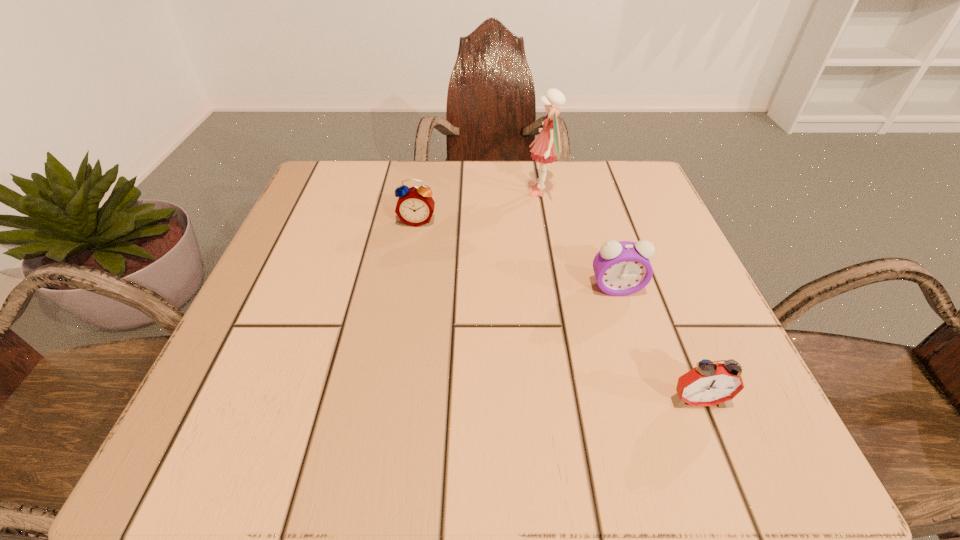
Where is `vacant space positioned on the face of the third farthest object`? vacant space positioned on the face of the third farthest object is located at coordinates (656, 414).

Where is `free location located on the clock face of the nearest object`? free location located on the clock face of the nearest object is located at coordinates click(723, 464).

Locate an element on the screen. This screenshot has height=540, width=960. doll that is at the far edge is located at coordinates click(x=546, y=149).

In order to click on alarm clock at the far edge in this screenshot , I will do `click(415, 206)`.

You are a GUI agent. You are given a task and a screenshot of the screen. Output one action in this format:
    pyautogui.click(x=<x>, y=<y>)
    Task: Click on the object that is positioned at the near edge
    
    Given the screenshot: What is the action you would take?
    pyautogui.click(x=708, y=384)

Where is `object located in the near right corner section of the desktop`? Image resolution: width=960 pixels, height=540 pixels. object located in the near right corner section of the desktop is located at coordinates (708, 384).

Identify the location of free region at the far edge of the desktop. (438, 210).

The height and width of the screenshot is (540, 960). Find the location of `vacant area at the near edge`. vacant area at the near edge is located at coordinates (486, 403).

You are a GUI agent. You are given a task and a screenshot of the screen. Output one action in this format:
    pyautogui.click(x=<x>, y=<y>)
    Task: Click on the free space at the left edge of the desktop
    
    Given the screenshot: What is the action you would take?
    pyautogui.click(x=311, y=229)

Where is `free region at the right edge`? free region at the right edge is located at coordinates (635, 389).